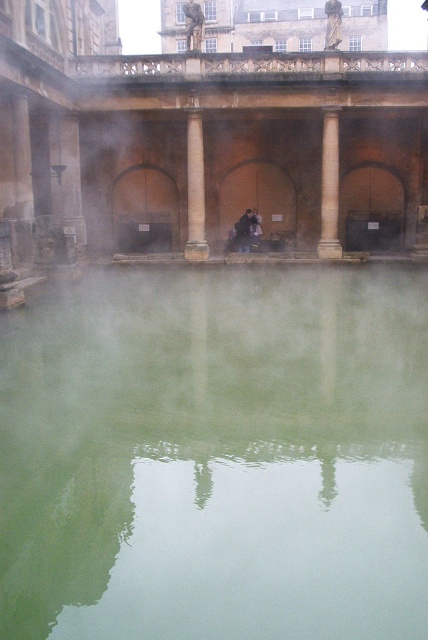
Question: Among these objects, which one is nearest to the camera?

Choices:
 (A) smooth stone column at center
 (B) brown stone column at center

Answer: (A)

Question: Which object appears farthest from the camera in this image?

Choices:
 (A) green reflective water at center
 (B) dark brown leather jacket at center
 (C) smooth stone column at center

Answer: (B)

Question: Which object appears farthest from the camera in this image?

Choices:
 (A) green reflective water at center
 (B) dark brown leather jacket at center
 (C) brown stone column at center

Answer: (B)

Question: Does smooth stone column at center appear under brown stone column at center?

Choices:
 (A) no
 (B) yes

Answer: (B)

Question: Is brown stone column at center bigger than dark brown leather jacket at center?

Choices:
 (A) yes
 (B) no

Answer: (B)

Question: Is smooth stone column at center to the right of dark brown leather jacket at center from the viewer's perspective?

Choices:
 (A) yes
 (B) no

Answer: (A)